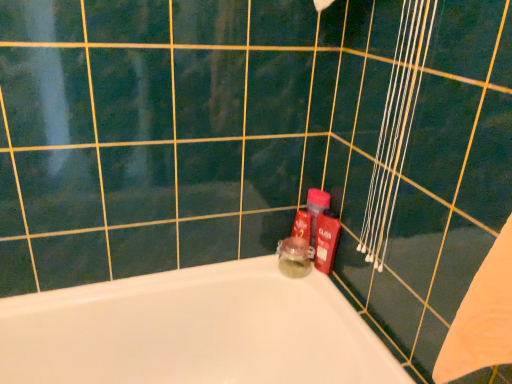
Identify the location of free space in front of shiny plastic bottle at right, marked as the 2th toiletry in a left-to-right arrangement. Image resolution: width=512 pixels, height=384 pixels. coord(334,298).